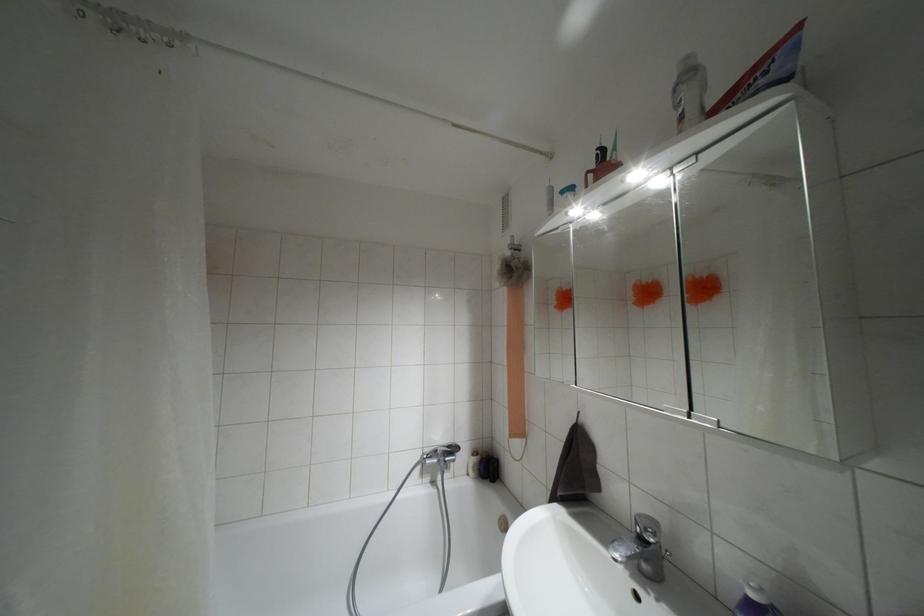
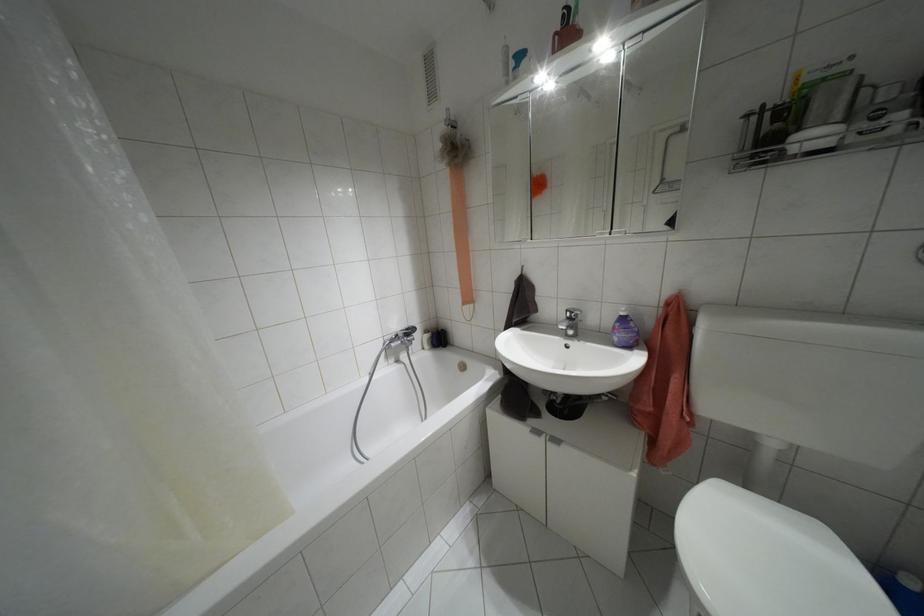
First-person continuous shooting, in which direction is the camera rotating?

The camera rotated toward right-down.